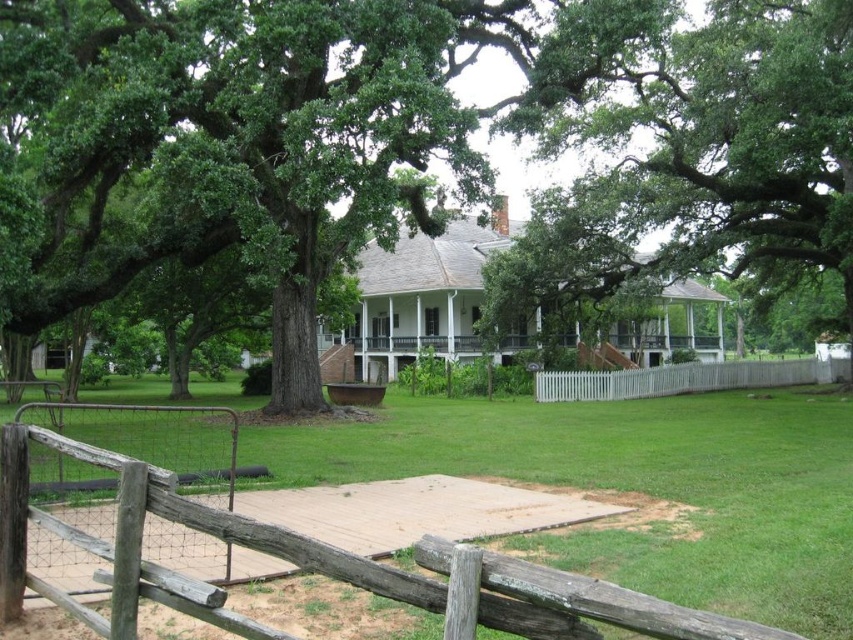
You are standing in front of the house and notice the green leafy tree at center and the white wooden porch at center. Which object is higher in elevation?

The green leafy tree at center is above the white wooden porch at center, so the tree is higher in elevation.

You are standing in the front yard of the house and want to walk from the brown wooden fence at lower center to the white wooden porch at center. Which direction should you move to reach the porch?

The brown wooden fence at lower center is located below the white wooden porch at center, so you should move upward to reach the porch.

You are standing in front of the historic house and want to walk from the brown wooden fence at lower center to the white wooden porch at center. Which direction should you move to get closer to the porch?

You should move away from the viewer because the brown wooden fence at lower center is closer to the viewer than the white wooden porch at center, so moving away from the fence towards the porch would bring you closer to it.